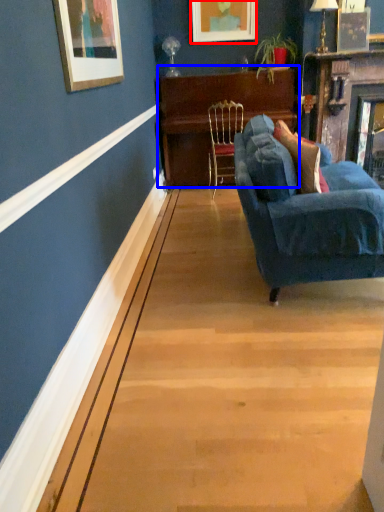
Question: Among these objects, which one is farthest to the camera, picture frame (highlighted by a red box) or table (highlighted by a blue box)?

Choices:
 (A) picture frame
 (B) table

Answer: (A)